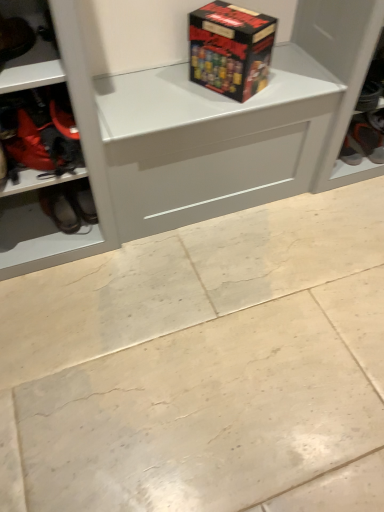
Question: Is matte black shoe at left, which ranks as the 4th footwear in back-to-front order, completely or partially inside beige marble floor at center?

Choices:
 (A) yes
 (B) no

Answer: (B)

Question: Can you confirm if beige marble floor at center is thinner than matte black shoe at left, which ranks as the 4th footwear in back-to-front order?

Choices:
 (A) yes
 (B) no

Answer: (B)

Question: Are beige marble floor at center and matte black shoe at left, the first footwear viewed from the left, located far from each other?

Choices:
 (A) no
 (B) yes

Answer: (A)

Question: Is beige marble floor at center facing away from matte black shoe at left, which is the 4th footwear from right to left?

Choices:
 (A) no
 (B) yes

Answer: (A)

Question: From the image's perspective, is beige marble floor at center under matte black shoe at left, which ranks as the 4th footwear in back-to-front order?

Choices:
 (A) no
 (B) yes

Answer: (B)

Question: Is red fabric boot at left, placed as the 2th footwear when sorted from right to left, inside or outside of black leather shoes at lower left, which is the 3th footwear in front-to-back order?

Choices:
 (A) inside
 (B) outside

Answer: (B)

Question: Considering the positions of red fabric boot at left, placed as the 2th footwear when sorted from right to left, and black leather shoes at lower left, the third footwear in the right-to-left sequence, in the image, is red fabric boot at left, placed as the 2th footwear when sorted from right to left, wider or thinner than black leather shoes at lower left, the third footwear in the right-to-left sequence,?

Choices:
 (A) thin
 (B) wide

Answer: (B)

Question: Considering their positions, is red fabric boot at left, marked as the third footwear in a left-to-right arrangement, located in front of or behind black leather shoes at lower left, positioned as the 2th footwear in back-to-front order?

Choices:
 (A) front
 (B) behind

Answer: (A)

Question: Considering the positions of point (67, 133) and point (44, 196), is point (67, 133) closer or farther from the camera than point (44, 196)?

Choices:
 (A) closer
 (B) farther

Answer: (A)

Question: In terms of size, does orange fabric shoe at right, the 1th footwear when ordered from back to front, appear bigger or smaller than beige marble floor at center?

Choices:
 (A) big
 (B) small

Answer: (B)

Question: Is orange fabric shoe at right, which ranks as the 1th footwear in right-to-left order, spatially inside beige marble floor at center, or outside of it?

Choices:
 (A) inside
 (B) outside

Answer: (B)

Question: In terms of height, does orange fabric shoe at right, which is counted as the 4th footwear, starting from the front, look taller or shorter compared to beige marble floor at center?

Choices:
 (A) short
 (B) tall

Answer: (A)

Question: Visually, is orange fabric shoe at right, the 1th footwear when ordered from back to front, positioned to the left or to the right of beige marble floor at center?

Choices:
 (A) right
 (B) left

Answer: (A)

Question: Considering the positions of red fabric boot at left, acting as the 2th footwear starting from the front, and matt black box at upper center in the image, is red fabric boot at left, acting as the 2th footwear starting from the front, taller or shorter than matt black box at upper center?

Choices:
 (A) short
 (B) tall

Answer: (A)

Question: From a real-world perspective, relative to matt black box at upper center, is red fabric boot at left, acting as the 2th footwear starting from the front, vertically above or below?

Choices:
 (A) above
 (B) below

Answer: (B)